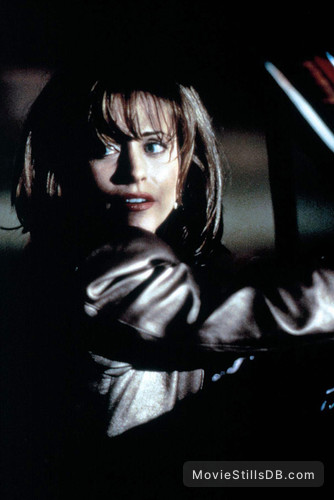
The image size is (334, 500). In order to click on window in this screenshot , I will do `click(255, 179)`.